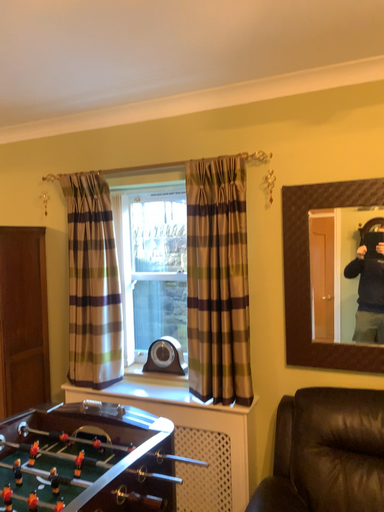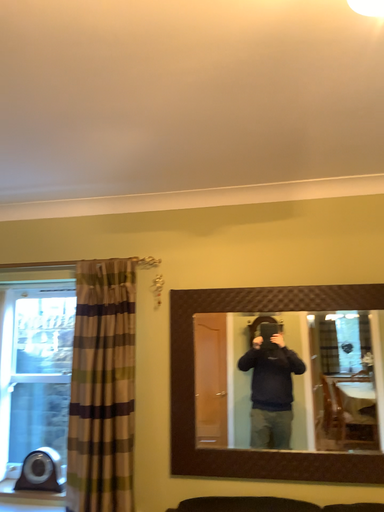
Question: Which way did the camera rotate in the video?

Choices:
 (A) rotated upward
 (B) rotated downward

Answer: (A)